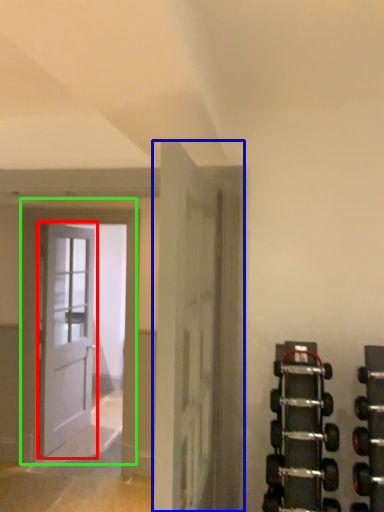
Question: Which object is the farthest from door (highlighted by a red box)? Choose among these: door (highlighted by a blue box) or door (highlighted by a green box).

Choices:
 (A) door
 (B) door

Answer: (A)